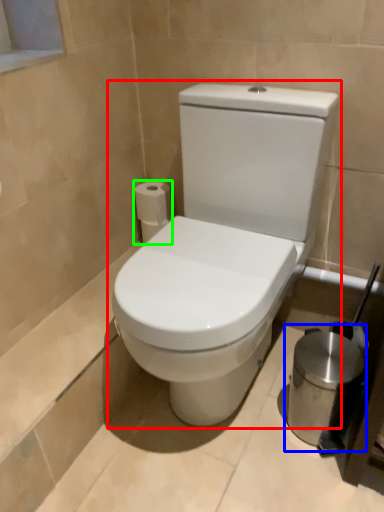
Question: Considering the real-world distances, which object is farthest from toilet (highlighted by a red box)? appliance (highlighted by a blue box) or toilet paper (highlighted by a green box)?

Choices:
 (A) appliance
 (B) toilet paper

Answer: (B)